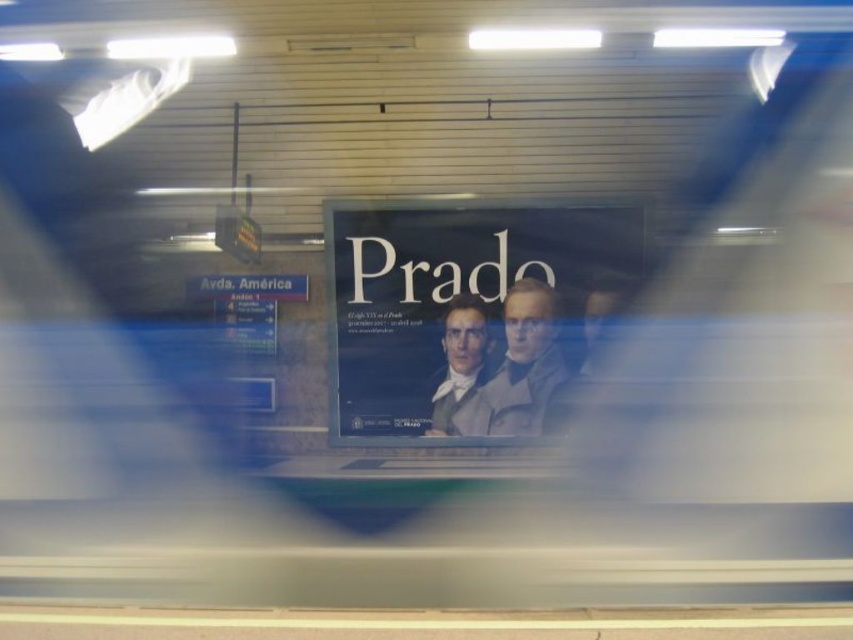
Question: Can you confirm if smooth gray coat at center is thinner than smooth gray suit at center?

Choices:
 (A) no
 (B) yes

Answer: (A)

Question: Can you confirm if smooth gray coat at center is thinner than smooth gray suit at center?

Choices:
 (A) yes
 (B) no

Answer: (B)

Question: Which of the following is the farthest from the observer?

Choices:
 (A) smooth gray coat at center
 (B) matte black poster at center

Answer: (A)

Question: Considering the relative positions of matte black poster at center and smooth gray suit at center in the image provided, where is matte black poster at center located with respect to smooth gray suit at center?

Choices:
 (A) right
 (B) left

Answer: (A)

Question: Which of the following is the farthest from the observer?

Choices:
 (A) smooth gray suit at center
 (B) smooth gray coat at center
 (C) matte black poster at center

Answer: (A)

Question: Which point is farther from the camera taking this photo?

Choices:
 (A) (500, 372)
 (B) (473, 298)

Answer: (B)